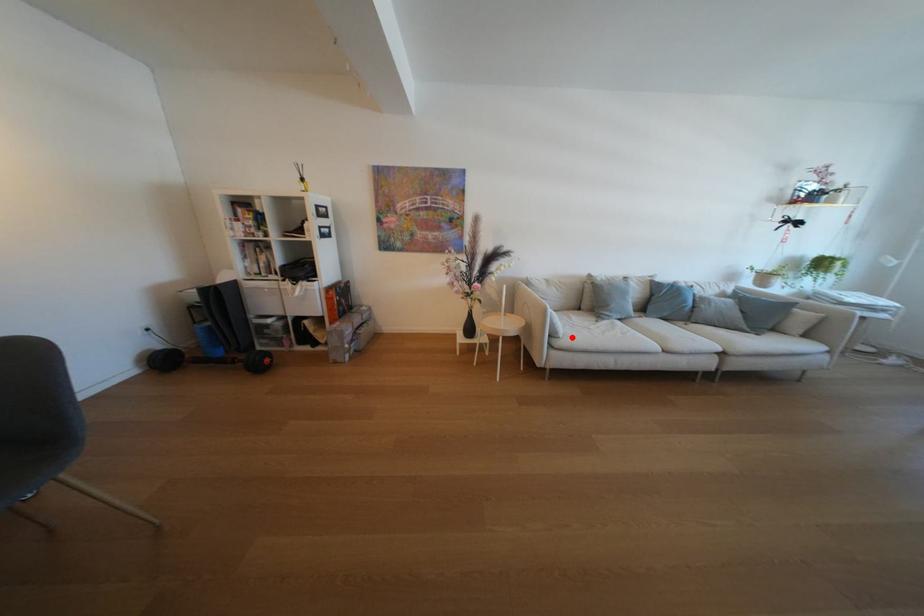
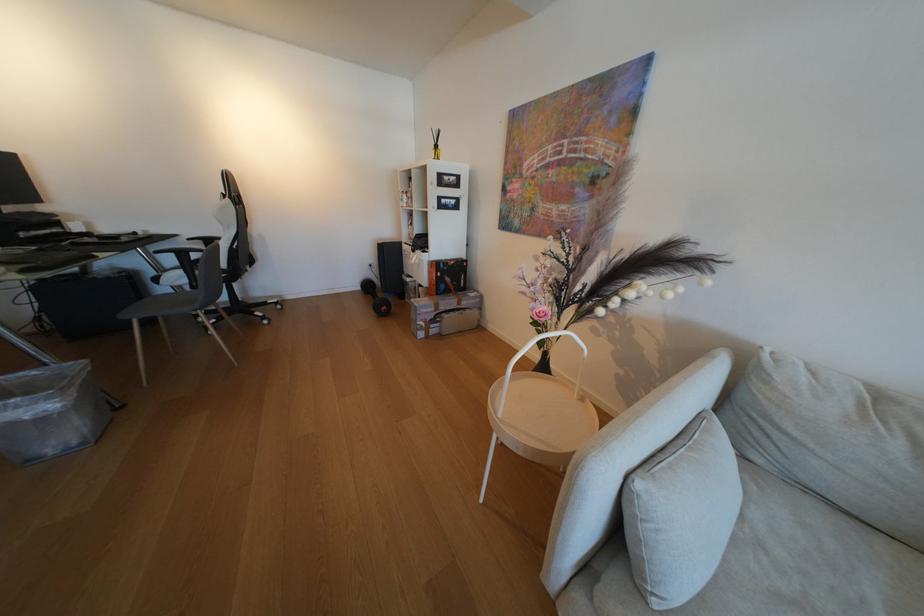
The point at the highlighted location is marked in the first image. Where is the corresponding point in the second image?

(665, 604)